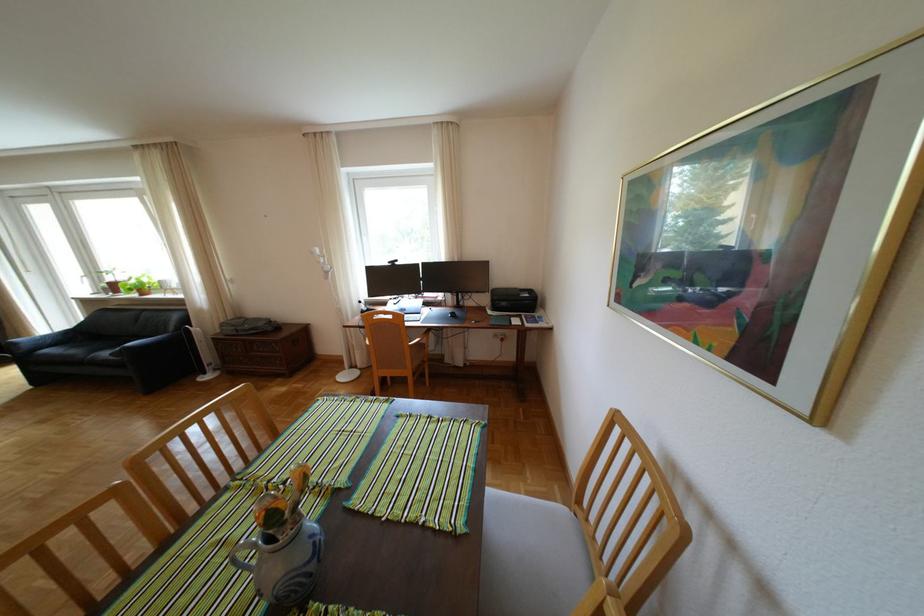
What do you see at coordinates (81, 345) in the screenshot?
I see `the sofa sitting surface` at bounding box center [81, 345].